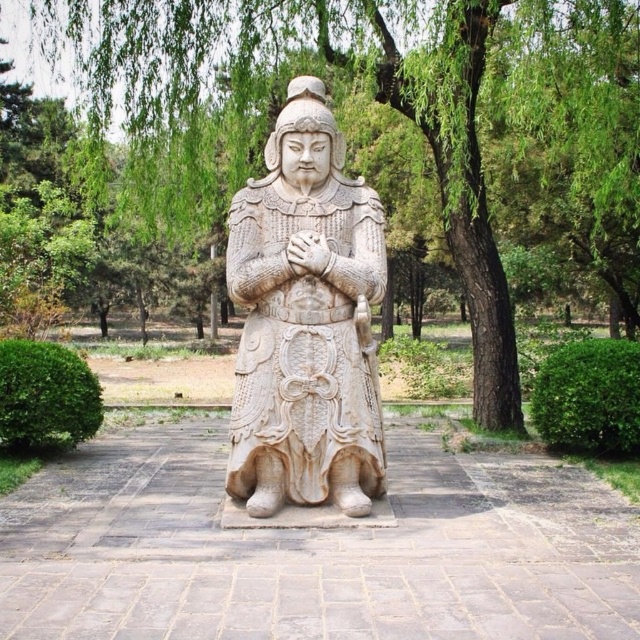
You are standing in a park and want to take a photo of the white stone statue at center without the green leafy tree at center blocking the view. Where should you position yourself relative to the statue?

You should move behind the white stone statue at center so that it is between you and the green leafy tree at center, as the tree is closer to you than the statue.

You are standing at the base of the statue and want to walk to the point marked at coordinates point (328, 29). If you first walk towards point (332, 438), will you be moving in the correct direction?

Point (328, 29) is behind point (332, 438), so walking towards point (332, 438) first would mean you are moving away from your target. You should instead move in the opposite direction of point (332, 438) to reach point (328, 29).

You are a gardener planning to trim the green leafy tree at center and the white stone statue at center. Which object requires less effort in terms of width when trimming? Please explain your reasoning based on their sizes.

The green leafy tree at center requires less effort in terms of width when trimming because its width is less than the white stone statue at center.